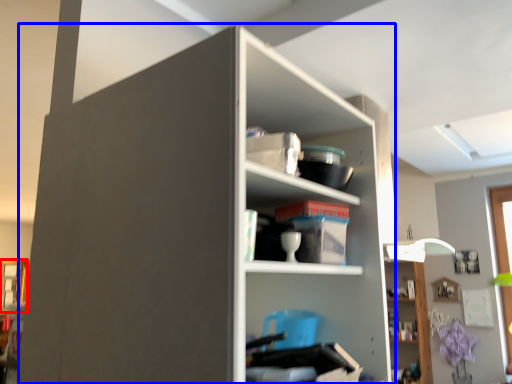
Question: Which object appears farthest to the camera in this image, window (highlighted by a red box) or shelf (highlighted by a blue box)?

Choices:
 (A) window
 (B) shelf

Answer: (A)